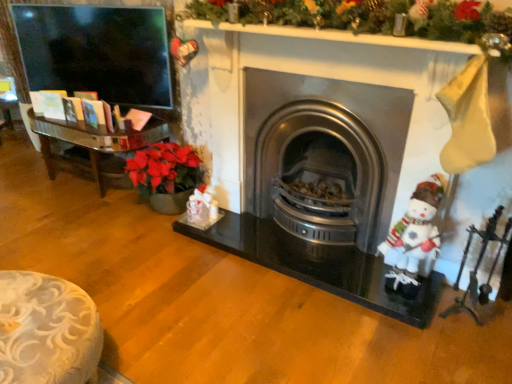
Locate an element on the screen. free space to the back side of metallic silver fireplace tools at right is located at coordinates (446, 295).